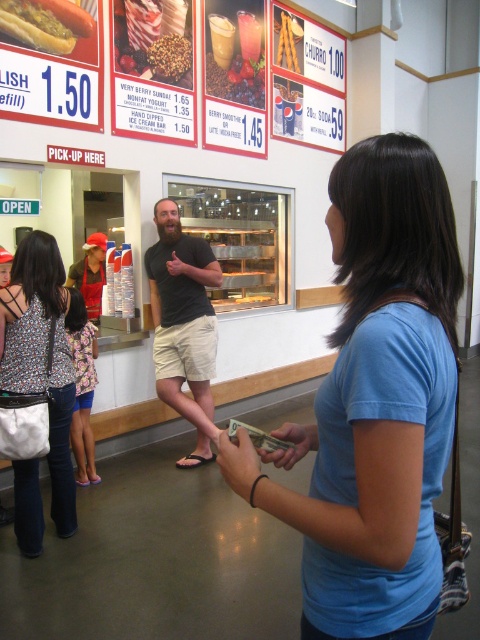
Who is positioned more to the left, smoothie cup at center or matte hot dog at center?

Positioned to the left is matte hot dog at center.

Identify the location of smoothie cup at center. This screenshot has height=640, width=480. pyautogui.click(x=154, y=38).

Where is `smoothie cup at center`? Image resolution: width=480 pixels, height=640 pixels. smoothie cup at center is located at coordinates (154, 38).

I want to click on smoothie cup at center, so click(x=154, y=38).

Is blue cotton shirt at center to the left of smoothie cup at center from the viewer's perspective?

In fact, blue cotton shirt at center is to the right of smoothie cup at center.

Is blue cotton shirt at center positioned in front of smoothie cup at center?

That is True.

Which is in front, point (304, 586) or point (169, 32)?

Positioned in front is point (304, 586).

The image size is (480, 640). I want to click on blue cotton shirt at center, so click(374, 403).

Is matte hot dog at center further to the viewer compared to berry smoothie at center?

No, it is in front of berry smoothie at center.

Which is in front, point (23, 42) or point (240, 67)?

Point (23, 42) is in front.

Locate an element on the screen. matte hot dog at center is located at coordinates (46, 22).